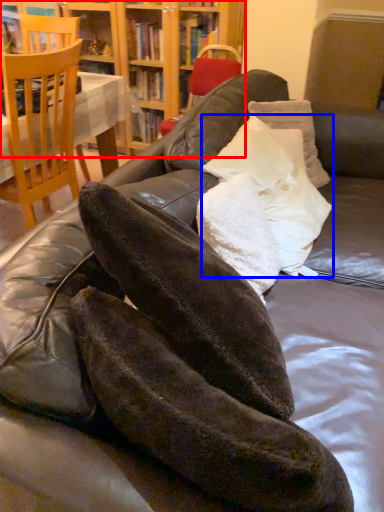
Question: Which point is closer to the camera, bookcase (highlighted by a red box) or pillow (highlighted by a blue box)?

Choices:
 (A) bookcase
 (B) pillow

Answer: (B)